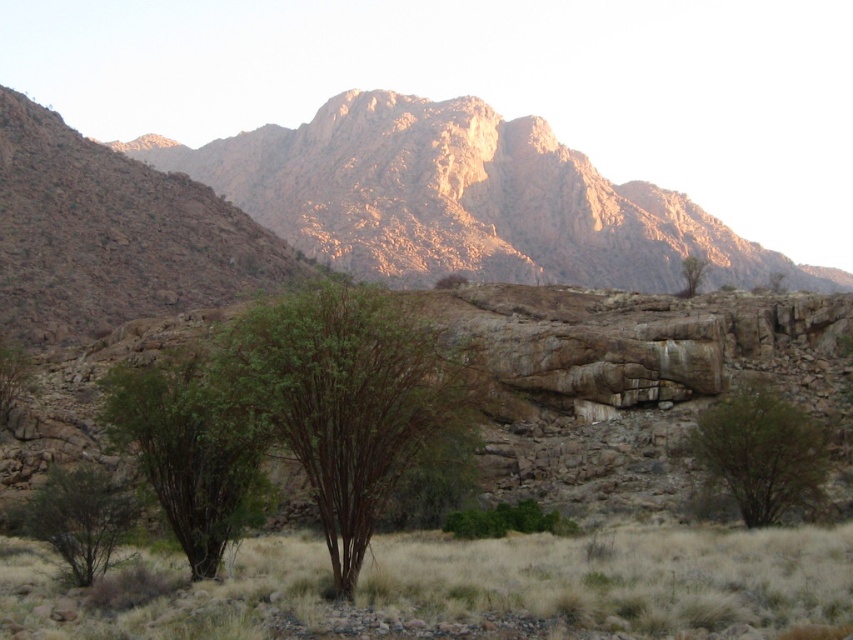
Question: Is green leafy tree at center bigger than green leafy tree at upper right?

Choices:
 (A) yes
 (B) no

Answer: (B)

Question: Which of these objects is positioned closest to the brown textured tree at center?

Choices:
 (A) green leafy shrub at center
 (B) green leafy shrub at lower left
 (C) rugged rock mountain at upper center
 (D) green leafy tree at center

Answer: (D)

Question: Does green leafy tree at center have a smaller size compared to green matte tree at lower left?

Choices:
 (A) no
 (B) yes

Answer: (A)

Question: Which point is farther to the camera?

Choices:
 (A) (698, 432)
 (B) (311, 490)
 (C) (526, 499)

Answer: (C)

Question: Which point is closer to the camera taking this photo?

Choices:
 (A) (570, 532)
 (B) (811, 436)
 (C) (346, 138)

Answer: (B)

Question: Where is rugged rock mountain at upper center located in relation to green matte tree at lower left in the image?

Choices:
 (A) right
 (B) left

Answer: (A)